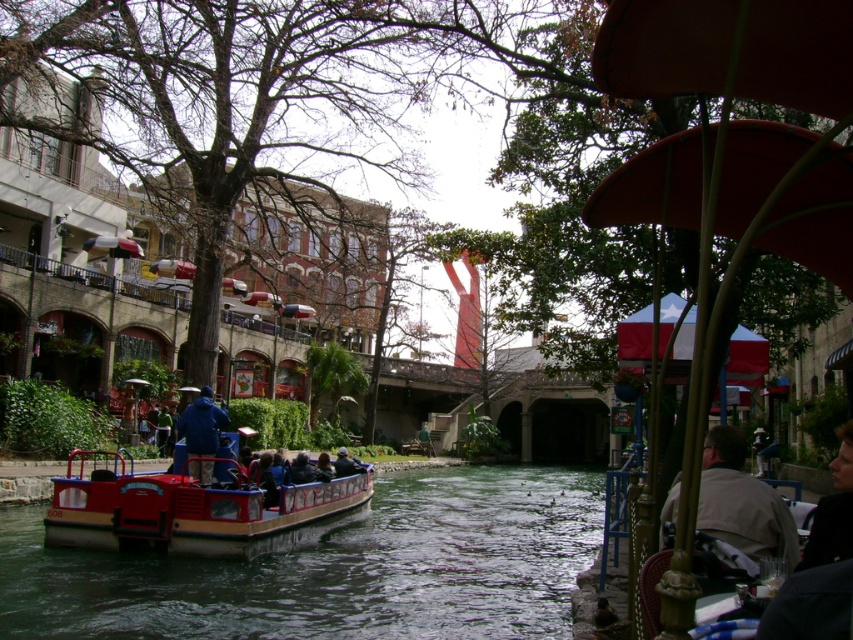
You are standing on the boat and want to hand a brochure to both the person wearing the light brown leather jacket at lower right and the person wearing the blue fabric jacket at center. Which jacket wearer should you hand the brochure to first to follow the shortest path?

You should hand the brochure to the light brown leather jacket at lower right first because it is closer to the viewer than the blue fabric jacket at center.

You are a photographer planning to take a photo of the smooth dark water at center and the dark blue jacket at center. Based on their positions, which object should you focus on first to ensure both are in the frame?

Since the smooth dark water at center might be wider than dark blue jacket at center, you should focus on the smooth dark water at center first to ensure it fits within the frame before adjusting for the smaller dark blue jacket at center.